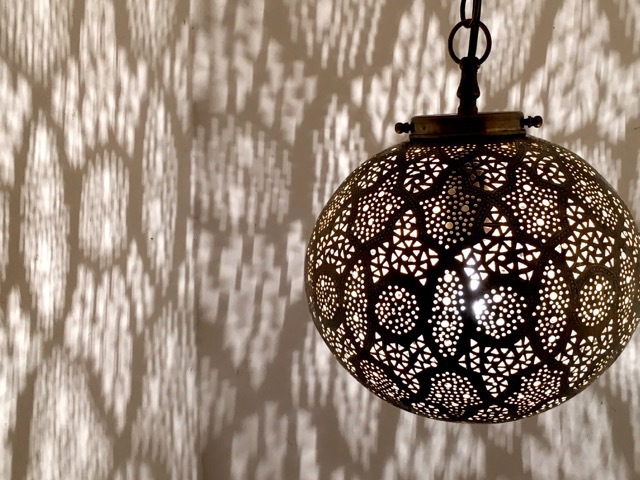
Where is `screws`? screws is located at coordinates (534, 122), (400, 124).